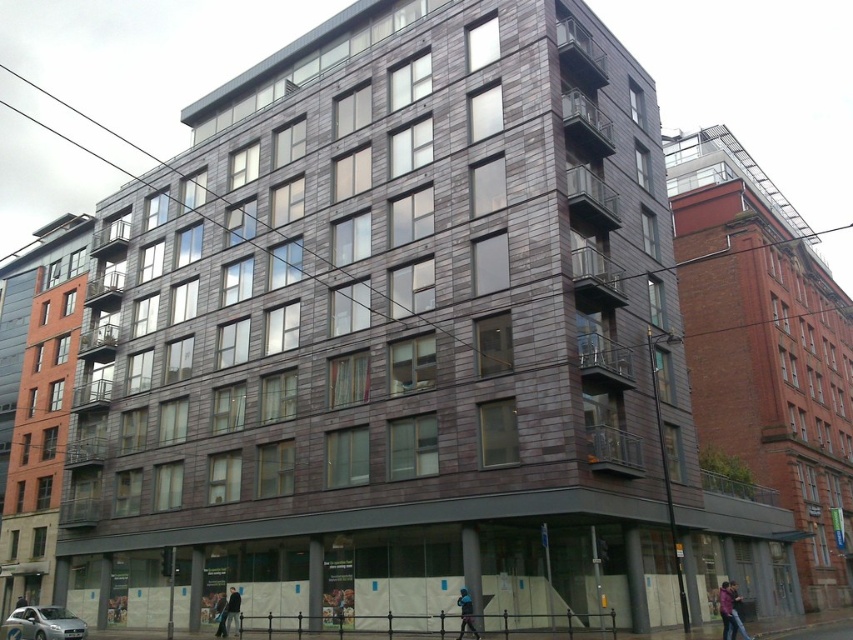
Question: Based on their relative distances, which object is farther from the dark blue jacket at lower right?

Choices:
 (A) dark gray fabric jacket at center
 (B) dark blue jacket at lower center
 (C) leather jacket at lower right

Answer: (A)

Question: Which of these objects is positioned farthest from the dark blue jacket at lower center?

Choices:
 (A) dark gray fabric jacket at center
 (B) dark blue jacket at center

Answer: (B)

Question: Considering the real-world distances, which object is farthest from the dark gray fabric jacket at center?

Choices:
 (A) dark blue jacket at lower center
 (B) leather jacket at lower right
 (C) dark blue jacket at lower right

Answer: (C)

Question: Does dark blue jacket at lower right appear over dark blue jacket at center?

Choices:
 (A) no
 (B) yes

Answer: (B)

Question: Is leather jacket at lower right positioned before dark blue jacket at lower right?

Choices:
 (A) yes
 (B) no

Answer: (B)

Question: Is dark blue jacket at lower center wider than dark blue jacket at lower right?

Choices:
 (A) no
 (B) yes

Answer: (A)